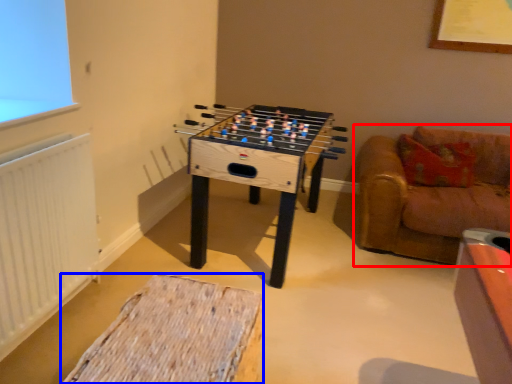
Question: Which object is closer to the camera taking this photo, studio couch (highlighted by a red box) or furniture (highlighted by a blue box)?

Choices:
 (A) studio couch
 (B) furniture

Answer: (B)